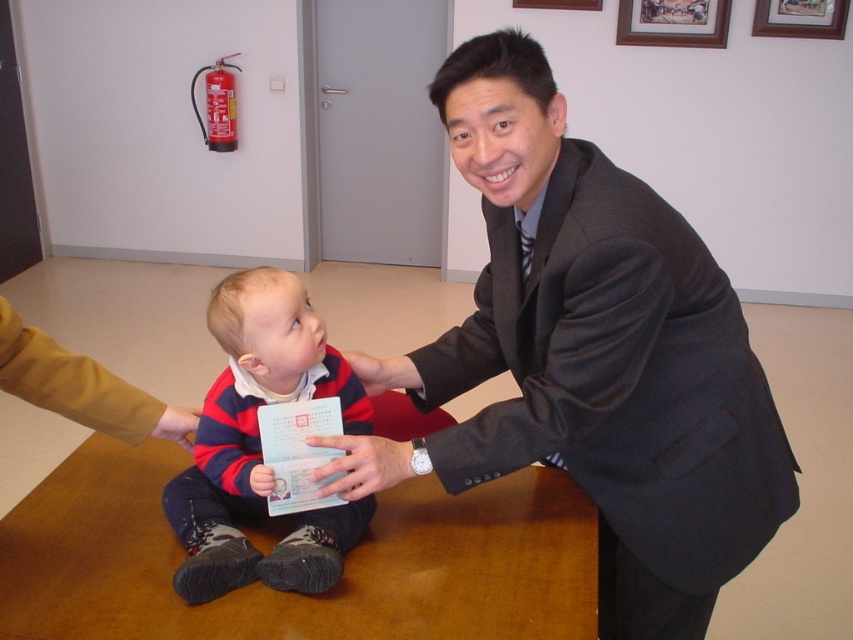
Does striped cotton shirt at center have a smaller size compared to matte plastic card at center?

Incorrect, striped cotton shirt at center is not smaller in size than matte plastic card at center.

Between striped cotton shirt at center and matte plastic card at center, which one has less height?

With less height is matte plastic card at center.

Find the location of a particular element. This screenshot has height=640, width=853. striped cotton shirt at center is located at coordinates (259, 444).

Consider the image. Which of these two, dark gray suit at center or striped cotton shirt at center, stands shorter?

With less height is striped cotton shirt at center.

Does dark gray suit at center have a lesser height compared to striped cotton shirt at center?

No.

Is point (502, 61) positioned in front of point (357, 433)?

Yes.

Find the location of a particular element. dark gray suit at center is located at coordinates (598, 353).

Is smooth skin hand at center to the left of matte plastic card at center from the viewer's perspective?

Incorrect, smooth skin hand at center is not on the left side of matte plastic card at center.

Is smooth skin hand at center in front of matte plastic card at center?

That is True.

Locate an element on the screen. The image size is (853, 640). smooth skin hand at center is located at coordinates (363, 465).